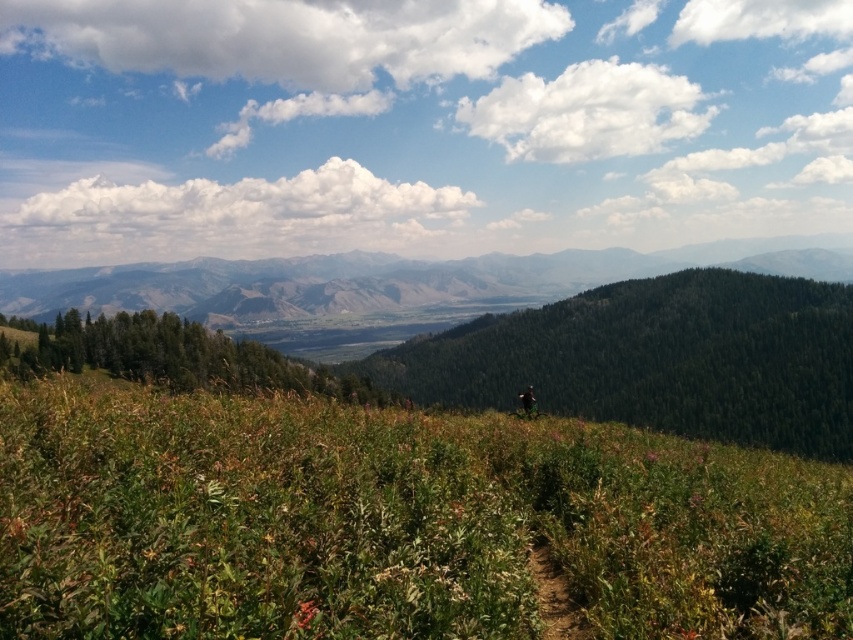
You are a hiker who wants to take a photo of the green leafy grass at center and the green matte jacket at center. Which object should you focus on first if you want to capture both in one shot?

The green leafy grass at center is positioned on the left side of the green matte jacket at center, so you should focus on the green leafy grass at center first to ensure both are in the frame.

You are standing at the starting point of the dirt path in the meadow and want to reach the green leafy grass at center. According to the coordinates provided, in which direction should you walk to reach it?

The green leafy grass at center is located at coordinates point (395, 522), so you should walk towards the center of the image to reach it.